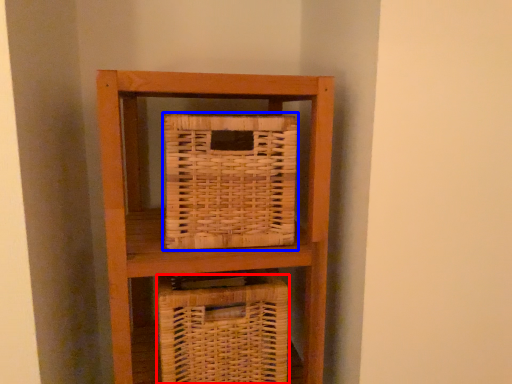
Question: Which object is closer to the camera taking this photo, basket (highlighted by a red box) or picnic basket (highlighted by a blue box)?

Choices:
 (A) basket
 (B) picnic basket

Answer: (B)